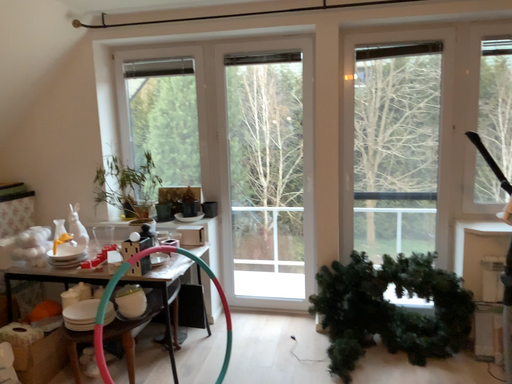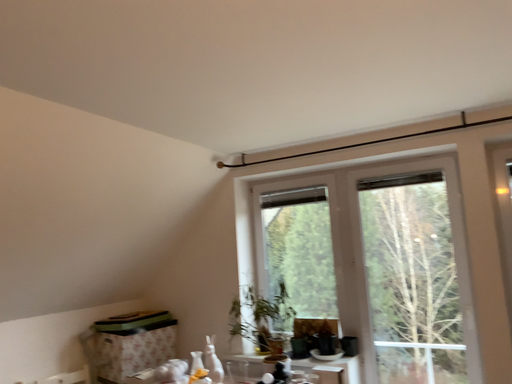
Question: How did the camera likely rotate when shooting the video?

Choices:
 (A) rotated upward
 (B) rotated downward

Answer: (A)